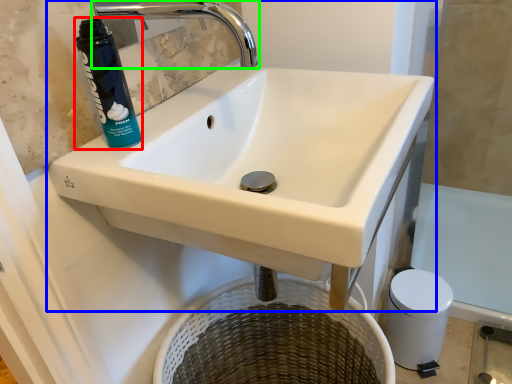
Question: Considering the real-world distances, which object is closest to cleaning product (highlighted by a red box)? sink (highlighted by a blue box) or tap (highlighted by a green box).

Choices:
 (A) sink
 (B) tap

Answer: (B)